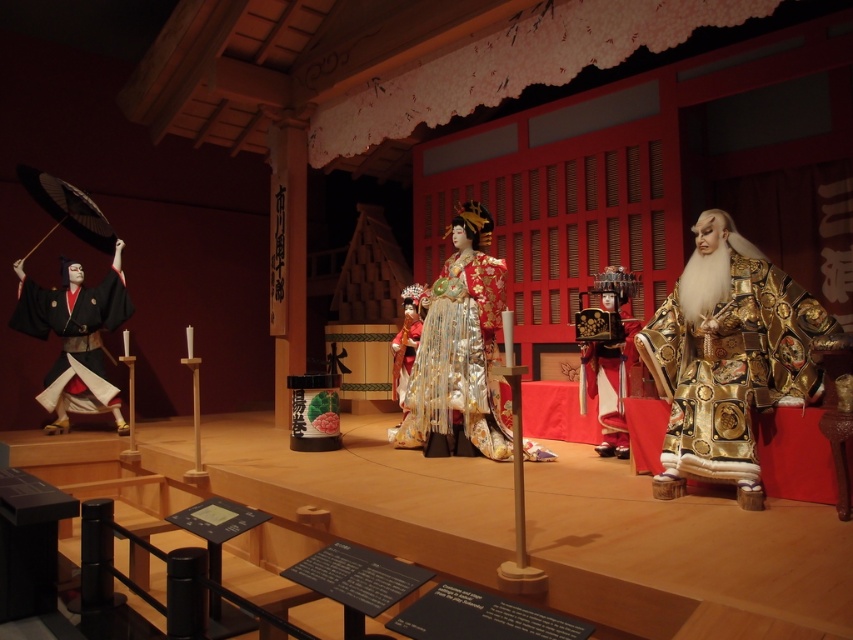
Which is in front, point (772, 381) or point (622, 275)?

Point (772, 381)

Between gold shiny robe at right and shiny gold helmet at center, which one appears on the right side from the viewer's perspective?

From the viewer's perspective, gold shiny robe at right appears more on the right side.

I want to click on gold shiny robe at right, so click(x=727, y=356).

In the scene shown: Between gold shiny robe at right and matte black kimono at left, which one is positioned lower?

matte black kimono at left is lower down.

Can you confirm if gold shiny robe at right is positioned below matte black kimono at left?

Actually, gold shiny robe at right is above matte black kimono at left.

Which is in front, point (695, 346) or point (109, 282)?

Point (695, 346) is in front.

At what (x,y) coordinates should I click in order to perform the action: click on gold shiny robe at right. Please return your answer as a coordinate pair (x, y). Looking at the image, I should click on (727, 356).

Is silk kimono at center taller than shiny gold helmet at center?

Yes, silk kimono at center is taller than shiny gold helmet at center.

Between silk kimono at center and shiny gold helmet at center, which one has less height?

Standing shorter between the two is shiny gold helmet at center.

Find the location of a particular element. silk kimono at center is located at coordinates (460, 348).